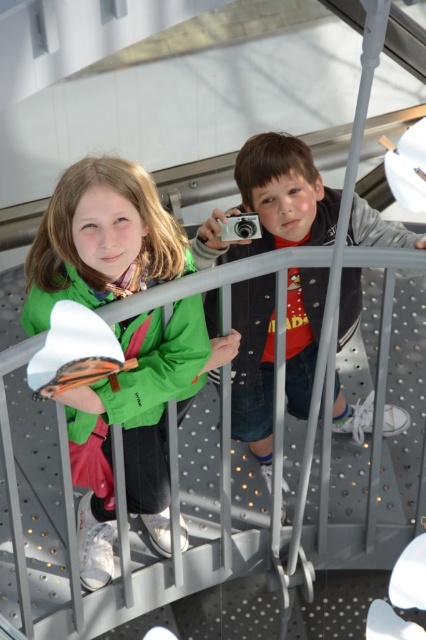
How distant is white matte camera at center from silver metallic camera at center?

The distance of white matte camera at center from silver metallic camera at center is 26.91 inches.

Can you confirm if white matte camera at center is shorter than silver metallic camera at center?

In fact, white matte camera at center may be taller than silver metallic camera at center.

Is point (313, 232) in front of point (222, 221)?

No, (313, 232) is behind (222, 221).

Identify the location of white matte camera at center. (273, 202).

Who is higher up, green matte jacket at left or green matte jacket at upper left?

green matte jacket at upper left is higher up.

Who is taller, green matte jacket at left or green matte jacket at upper left?

Standing taller between the two is green matte jacket at left.

The height and width of the screenshot is (640, 426). Identify the location of green matte jacket at left. (137, 428).

Does green matte jacket at upper left have a greater width compared to silver metallic camera at center?

Correct, the width of green matte jacket at upper left exceeds that of silver metallic camera at center.

Is green matte jacket at upper left below silver metallic camera at center?

Indeed, green matte jacket at upper left is positioned under silver metallic camera at center.

Between point (192, 300) and point (244, 232), which one is positioned in front?

Positioned in front is point (192, 300).

What are the coordinates of `green matte jacket at upper left` in the screenshot? It's located at (158, 364).